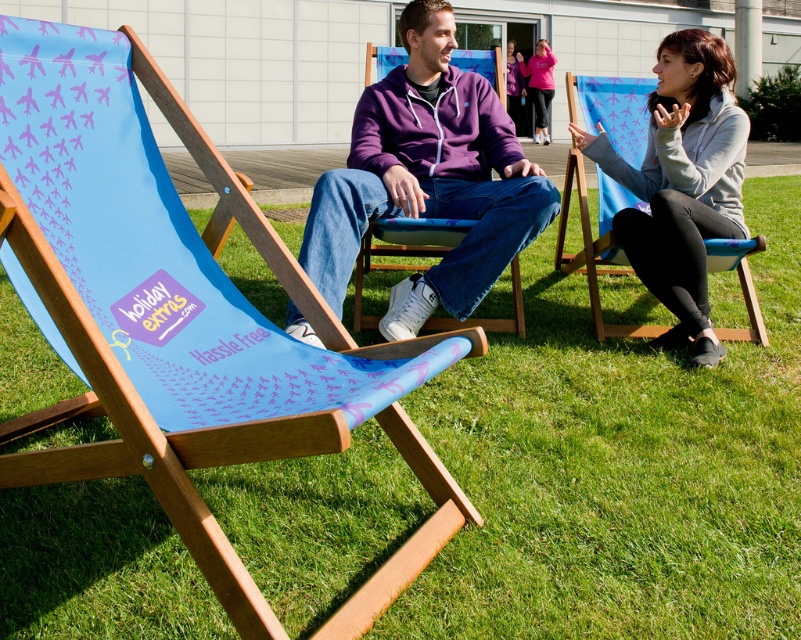
Question: In this image, where is gray fleece jacket at right located relative to matte pink hoodie at center?

Choices:
 (A) left
 (B) right

Answer: (A)

Question: Does purple fleece jacket at center have a lesser width compared to matte pink hoodie at center?

Choices:
 (A) yes
 (B) no

Answer: (B)

Question: Which object appears closest to the camera in this image?

Choices:
 (A) blue wood beach chair at center
 (B) gray fleece jacket at right

Answer: (A)

Question: Is blue wood beach chair at center smaller than matte pink hoodie at center?

Choices:
 (A) no
 (B) yes

Answer: (B)

Question: Which point is closer to the camera?

Choices:
 (A) (679, 328)
 (B) (445, 161)

Answer: (A)

Question: Estimate the real-world distances between objects in this image. Which object is farther from the blue wood beach chair at center?

Choices:
 (A) matte pink hoodie at center
 (B) purple fleece jacket at center

Answer: (A)